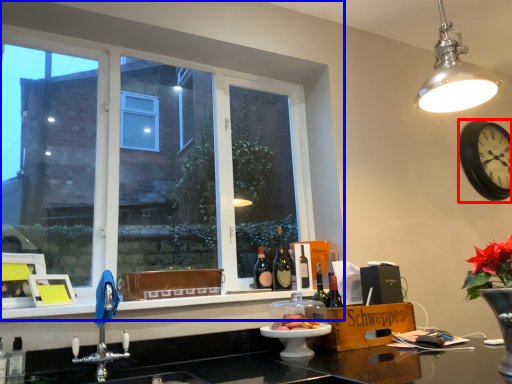
Question: Which point is further to the camera, clock (highlighted by a red box) or window (highlighted by a blue box)?

Choices:
 (A) clock
 (B) window

Answer: (A)